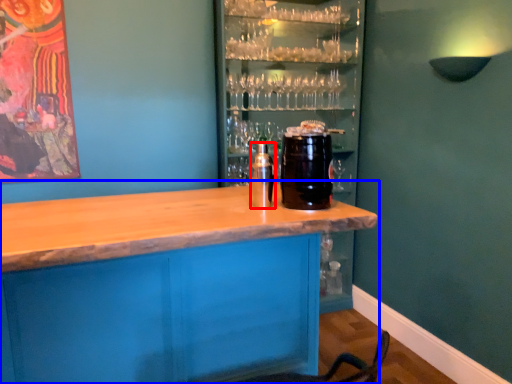
Question: Which object is closer to the camera taking this photo, beverage (highlighted by a red box) or table (highlighted by a blue box)?

Choices:
 (A) beverage
 (B) table

Answer: (B)